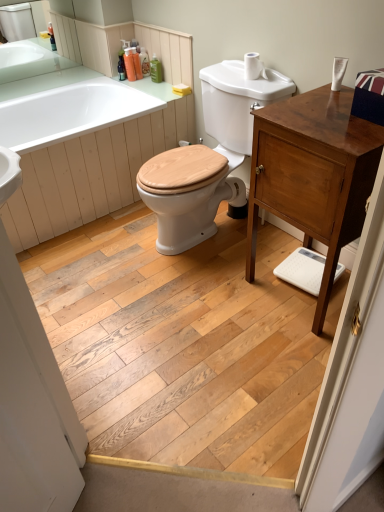
Where is `free point above natural wood floor at center (from a real-world perspective)`? This screenshot has width=384, height=512. free point above natural wood floor at center (from a real-world perspective) is located at coordinates (182, 319).